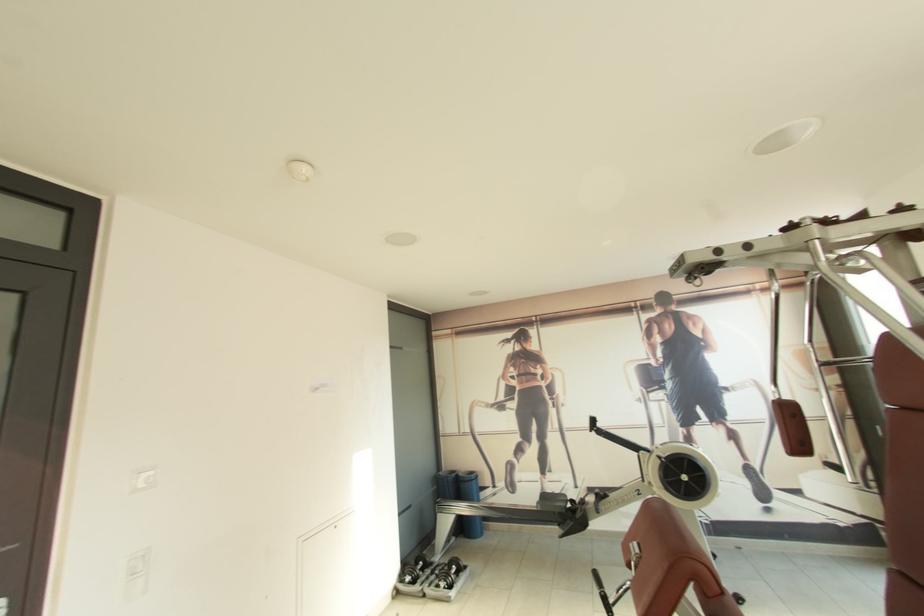
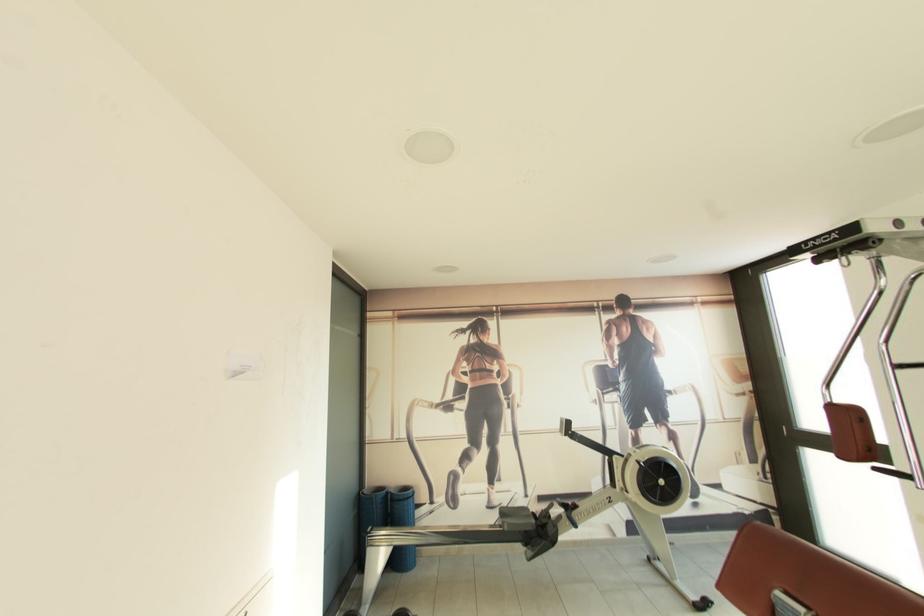
Locate, in the second image, the point that corresponds to (x=445, y=475) in the first image.

(371, 493)